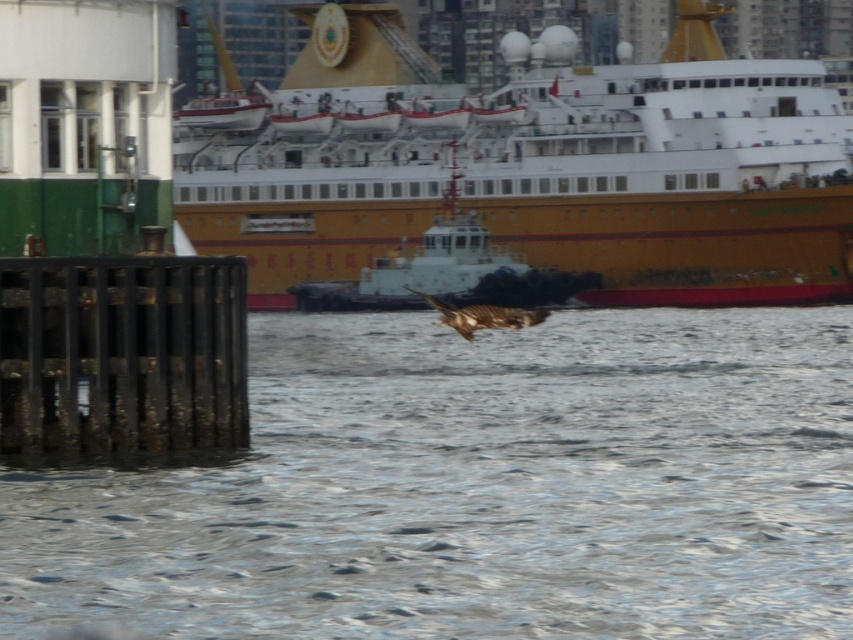
Question: Which is nearer to the gold/yellow ship at center?

Choices:
 (A) brown feathered bird at center
 (B) translucent gray water at center

Answer: (A)

Question: Where is gold/yellow ship at center located in relation to brown feathered bird at center in the image?

Choices:
 (A) right
 (B) left

Answer: (A)

Question: Where is translucent gray water at center located in relation to brown feathered bird at center in the image?

Choices:
 (A) right
 (B) left

Answer: (A)

Question: Which point is farther to the camera?

Choices:
 (A) translucent gray water at center
 (B) gold/yellow ship at center

Answer: (B)

Question: Considering the real-world distances, which object is farthest from the translucent gray water at center?

Choices:
 (A) gold/yellow ship at center
 (B) brown feathered bird at center

Answer: (A)

Question: Does translucent gray water at center appear on the left side of gold/yellow ship at center?

Choices:
 (A) no
 (B) yes

Answer: (B)